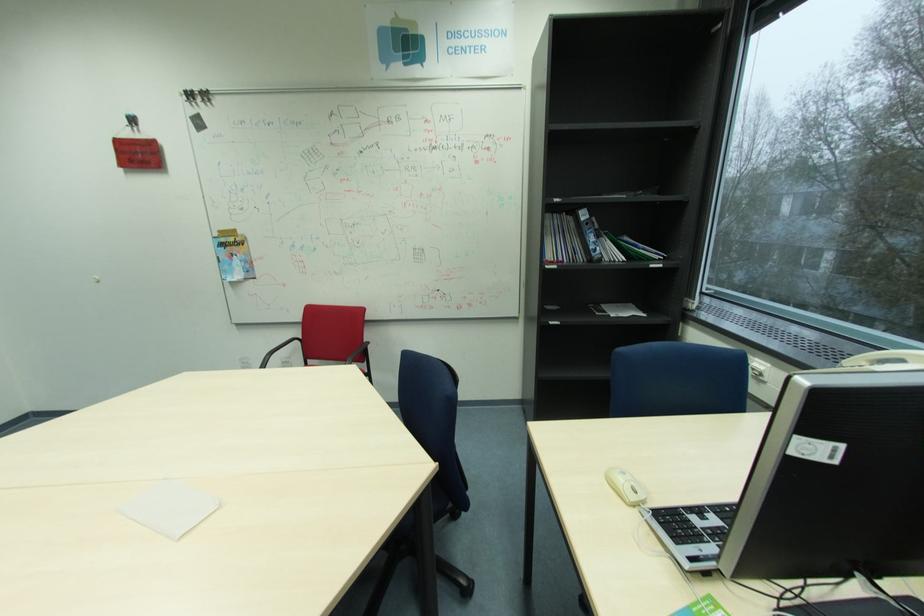
The height and width of the screenshot is (616, 924). Describe the element at coordinates (626, 485) in the screenshot. I see `the white telephone handset` at that location.